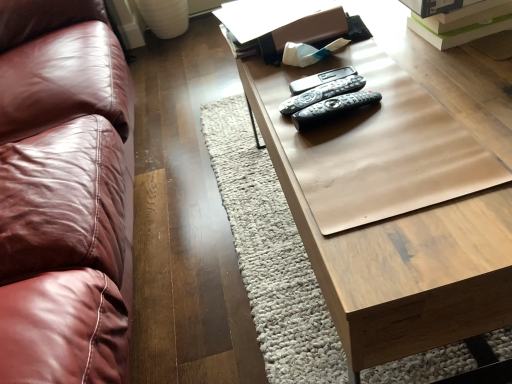
Question: Does black plastic remote at center, acting as the first remote starting from the back, have a larger size compared to black plastic remotes at center, which appears as the first remote when viewed from the front?

Choices:
 (A) yes
 (B) no

Answer: (B)

Question: Is black plastic remote at center, acting as the first remote starting from the back, positioned before black plastic remotes at center, which appears as the first remote when viewed from the front?

Choices:
 (A) yes
 (B) no

Answer: (B)

Question: Is black plastic remote at center, acting as the first remote starting from the back, oriented towards black plastic remotes at center, which appears as the first remote when viewed from the front?

Choices:
 (A) no
 (B) yes

Answer: (A)

Question: Does black plastic remote at center, acting as the first remote starting from the back, have a lesser height compared to black plastic remotes at center, which appears as the first remote when viewed from the front?

Choices:
 (A) yes
 (B) no

Answer: (A)

Question: Considering the relative sizes of black plastic remote at center, acting as the first remote starting from the back, and black plastic remotes at center, acting as the third remote starting from the back, in the image provided, is black plastic remote at center, acting as the first remote starting from the back, thinner than black plastic remotes at center, acting as the third remote starting from the back,?

Choices:
 (A) no
 (B) yes

Answer: (B)

Question: Considering the relative sizes of black plastic remote at center, acting as the first remote starting from the back, and black plastic remotes at center, which appears as the first remote when viewed from the front, in the image provided, is black plastic remote at center, acting as the first remote starting from the back, wider than black plastic remotes at center, which appears as the first remote when viewed from the front,?

Choices:
 (A) no
 (B) yes

Answer: (A)

Question: Is black plastic remotes at center, which appears as the 2th remote when viewed from the front, closer to camera compared to black plastic remote at center, the third remote from the front?

Choices:
 (A) yes
 (B) no

Answer: (A)

Question: Is black plastic remotes at center, arranged as the 2th remote when viewed from the back, placed right next to black plastic remote at center, acting as the first remote starting from the back?

Choices:
 (A) yes
 (B) no

Answer: (A)

Question: Considering the relative sizes of black plastic remotes at center, which appears as the 2th remote when viewed from the front, and black plastic remote at center, acting as the first remote starting from the back, in the image provided, is black plastic remotes at center, which appears as the 2th remote when viewed from the front, wider than black plastic remote at center, acting as the first remote starting from the back,?

Choices:
 (A) yes
 (B) no

Answer: (A)

Question: From the image's perspective, is black plastic remotes at center, arranged as the 2th remote when viewed from the back, below black plastic remote at center, acting as the first remote starting from the back?

Choices:
 (A) no
 (B) yes

Answer: (B)

Question: Considering the relative positions of black plastic remotes at center, which appears as the 2th remote when viewed from the front, and black plastic remote at center, the third remote from the front, in the image provided, is black plastic remotes at center, which appears as the 2th remote when viewed from the front, to the left of black plastic remote at center, the third remote from the front, from the viewer's perspective?

Choices:
 (A) no
 (B) yes

Answer: (B)

Question: Considering the relative sizes of black plastic remotes at center, which appears as the 2th remote when viewed from the front, and black plastic remote at center, acting as the first remote starting from the back, in the image provided, is black plastic remotes at center, which appears as the 2th remote when viewed from the front, smaller than black plastic remote at center, acting as the first remote starting from the back,?

Choices:
 (A) no
 (B) yes

Answer: (B)

Question: Is black plastic remote at center, acting as the first remote starting from the back, thinner than wooden table at center?

Choices:
 (A) no
 (B) yes

Answer: (B)